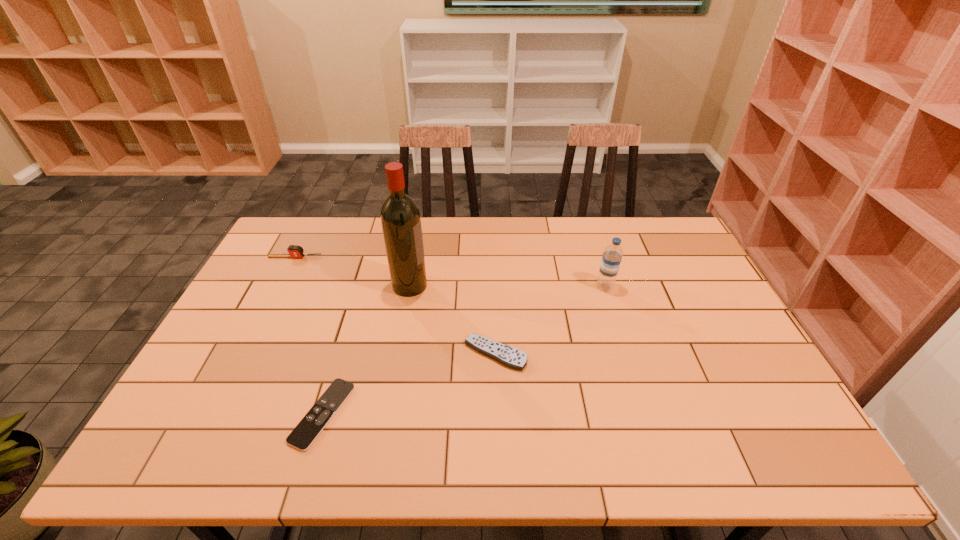
Identify the location of vacant space that is in between the wine bottle and the third tallest object. This screenshot has width=960, height=540. (352, 271).

The width and height of the screenshot is (960, 540). I want to click on free area in between the third object from right to left and the right remote control, so click(x=452, y=320).

The width and height of the screenshot is (960, 540). Identify the location of unoccupied position between the fourth shortest object and the farthest object. (450, 272).

This screenshot has width=960, height=540. Find the location of `vacant space that is in between the tape measure and the taller remote control`. vacant space that is in between the tape measure and the taller remote control is located at coordinates (396, 306).

Find the location of a particular element. The image size is (960, 540). free space between the third object from right to left and the tape measure is located at coordinates (352, 271).

In order to click on vacant area between the water bottle and the tape measure in this screenshot , I will do `click(450, 272)`.

Locate an element on the screen. unoccupied area between the leftmost object and the tallest object is located at coordinates (352, 271).

Select which object is the fourth closest to the tallest object. Please provide its 2D coordinates. Your answer should be formatted as a tuple, i.e. [(x, y)], where the tuple contains the x and y coordinates of a point satisfying the conditions above.

[(612, 255)]

Select which object is the second closest to the shorter remote control. Please provide its 2D coordinates. Your answer should be formatted as a tuple, i.e. [(x, y)], where the tuple contains the x and y coordinates of a point satisfying the conditions above.

[(400, 218)]

Locate an element on the screen. The width and height of the screenshot is (960, 540). free region that satisfies the following two spatial constraints: 1. on the label of the water bottle; 2. on the front side of the nearest object is located at coordinates (645, 414).